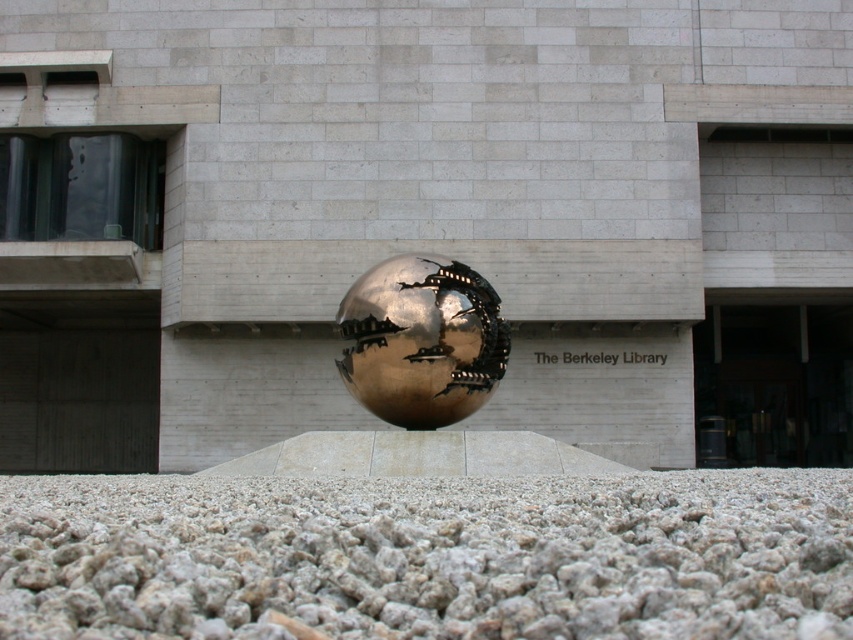
In the scene shown: You are an architect designing a new garden layout. You need to place a small decorative plant pot between the gray gravel at lower center and the gold metallic sphere at center. Based on their sizes, which object should the plant pot be closer to?

The gray gravel at lower center is thinner than the gold metallic sphere at center, so the plant pot should be placed closer to the gray gravel at lower center to maintain balance between their sizes.

You are a landscape architect designing a pathway. You need to ensure that visitors can easily walk around the gold metallic sphere at center without stepping on the gray gravel at lower center. Is the height difference between them sufficient for this requirement?

The gray gravel at lower center is shorter than the gold metallic sphere at center, so the height difference is sufficient to allow visitors to walk around the sphere without stepping on the gravel.

You are an architect analyzing the layout of this modern space. Based on the scene, which object is positioned lower in the image, the gray gravel at lower center or the gold metallic sphere at center?

The gray gravel at lower center is positioned below the gold metallic sphere at center, so the gray gravel at lower center is lower in the image.